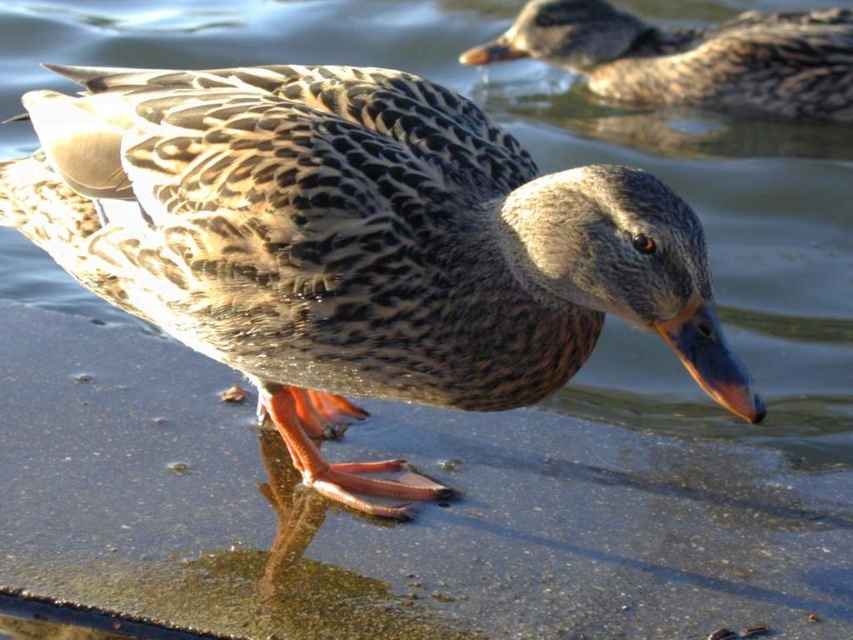
Between speckled feathered duck at center and speckled feathered duck at upper center, which one appears on the left side from the viewer's perspective?

speckled feathered duck at center

Looking at this image, is speckled feathered duck at center behind speckled feathered duck at upper center?

No, it is in front of speckled feathered duck at upper center.

The width and height of the screenshot is (853, 640). I want to click on speckled feathered duck at center, so click(x=357, y=244).